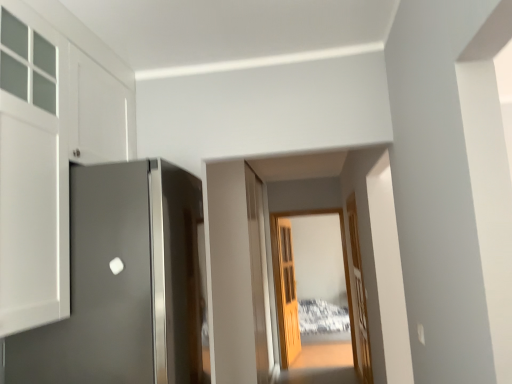
Question: Should I look upward or downward to see transparent wooden door at center?

Choices:
 (A) up
 (B) down

Answer: (B)

Question: Would you consider satin gray door at left, the 1th door in the front-to-back sequence, to be distant from transparent wooden door at center?

Choices:
 (A) no
 (B) yes

Answer: (B)

Question: From a real-world perspective, does satin gray door at left, the 1th door in the front-to-back sequence, sit lower than transparent wooden door at center?

Choices:
 (A) no
 (B) yes

Answer: (A)

Question: Is satin gray door at left, the third door positioned from the right, at the right side of transparent wooden door at center?

Choices:
 (A) yes
 (B) no

Answer: (B)

Question: Is satin gray door at left, the third door positioned from the right, looking in the opposite direction of transparent wooden door at center?

Choices:
 (A) yes
 (B) no

Answer: (B)

Question: Could you tell me if satin gray door at left, the third door positioned from the right, is turned towards transparent wooden door at center?

Choices:
 (A) yes
 (B) no

Answer: (B)

Question: From a real-world perspective, is satin gray door at left, the third door in the back-to-front sequence, on top of transparent wooden door at center?

Choices:
 (A) no
 (B) yes

Answer: (B)

Question: Is light brown wooden door at center, marked as the second door in a left-to-right arrangement, facing towards satin gray door at left, the 1th door in the left-to-right sequence?

Choices:
 (A) no
 (B) yes

Answer: (A)

Question: From the image's perspective, is light brown wooden door at center, the 1th door when ordered from back to front, on satin gray door at left, the 1th door in the front-to-back sequence?

Choices:
 (A) yes
 (B) no

Answer: (B)

Question: Does light brown wooden door at center, marked as the second door in a left-to-right arrangement, have a greater height compared to satin gray door at left, the 1th door in the left-to-right sequence?

Choices:
 (A) no
 (B) yes

Answer: (B)

Question: Is light brown wooden door at center, the 3th door in the front-to-back sequence, with satin gray door at left, the 1th door in the front-to-back sequence?

Choices:
 (A) no
 (B) yes

Answer: (A)

Question: Is light brown wooden door at center, marked as the second door in a left-to-right arrangement, closer to the viewer compared to satin gray door at left, the third door in the back-to-front sequence?

Choices:
 (A) no
 (B) yes

Answer: (A)

Question: Can you confirm if light brown wooden door at center, placed as the second door when sorted from right to left, is positioned to the left of satin gray door at left, the 1th door in the front-to-back sequence?

Choices:
 (A) no
 (B) yes

Answer: (A)

Question: Is light brown wooden door at center, marked as the second door in a left-to-right arrangement, with transparent wooden door at center?

Choices:
 (A) yes
 (B) no

Answer: (B)